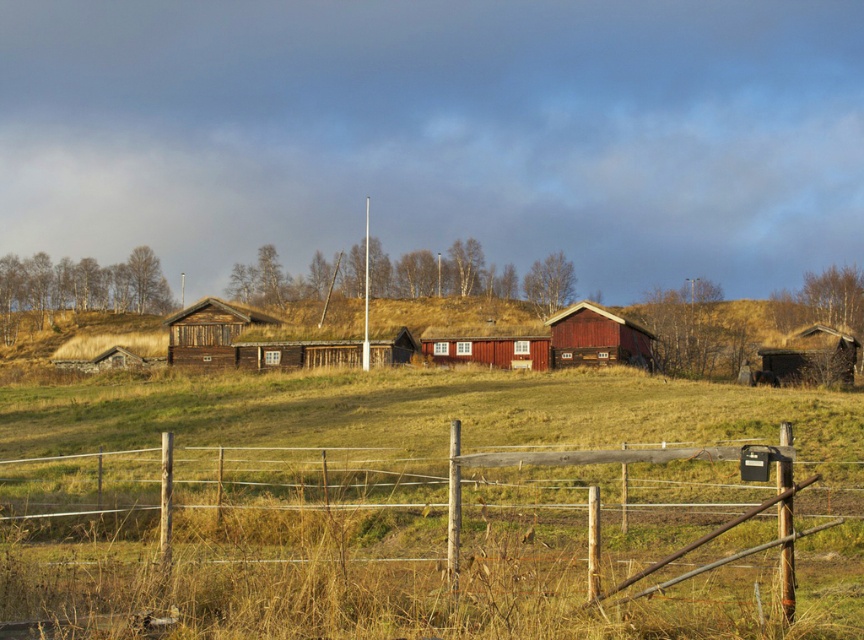
Question: Which of the following is the closest to the observer?

Choices:
 (A) matte wooden hut at center
 (B) wooden gate at lower center

Answer: (B)

Question: Can you confirm if wooden gate at lower center is positioned to the left of red wooden barn at center?

Choices:
 (A) yes
 (B) no

Answer: (A)

Question: Where is wooden gate at lower center located in relation to matte wooden hut at center in the image?

Choices:
 (A) right
 (B) left

Answer: (B)

Question: Which point is closer to the camera?

Choices:
 (A) (0, 486)
 (B) (445, 362)

Answer: (A)

Question: Is red wooden barn at center positioned at the back of matte wooden hut at center?

Choices:
 (A) yes
 (B) no

Answer: (B)

Question: Which is farther from the wooden gate at lower center?

Choices:
 (A) matte wooden hut at center
 (B) red wooden barn at center

Answer: (A)